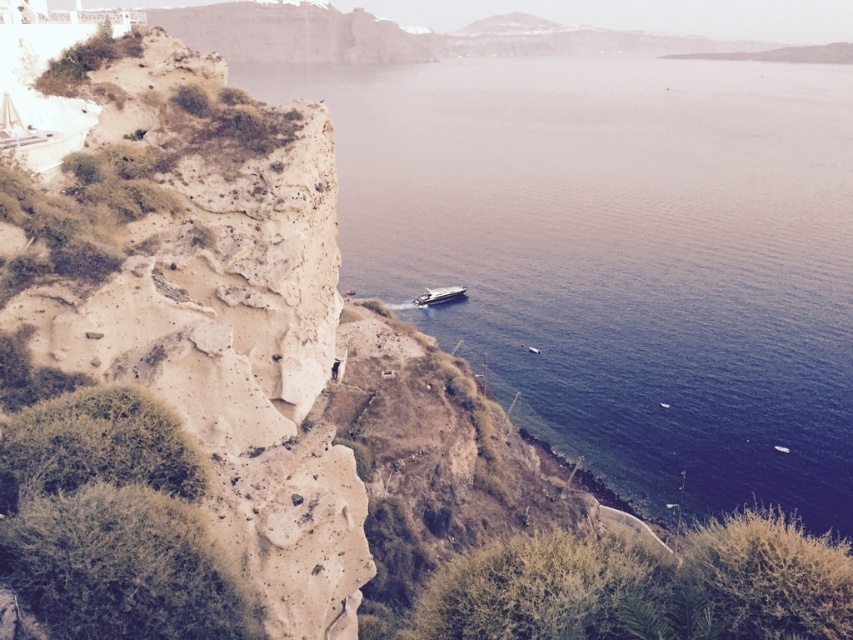
You are a photographer planning to capture the scene of the rugged cliff and the sea. You want to ensure that both the blue water at center and the metallic silver boat at center are clearly visible in your shot. Given their sizes, which object should you focus on first to ensure they are both in frame?

The blue water at center has a larger size compared to the metallic silver boat at center. To ensure both are in frame, focus on the larger blue water at center first, then adjust to include the smaller metallic silver boat at center.

You are standing at the cliff edge looking out at the sea. There are two points marked in the image. Which point, point (845, 116) or point (463, 298), is closer to you?

Point (845, 116) is closer to you because it is further to the viewer than point (463, 298).